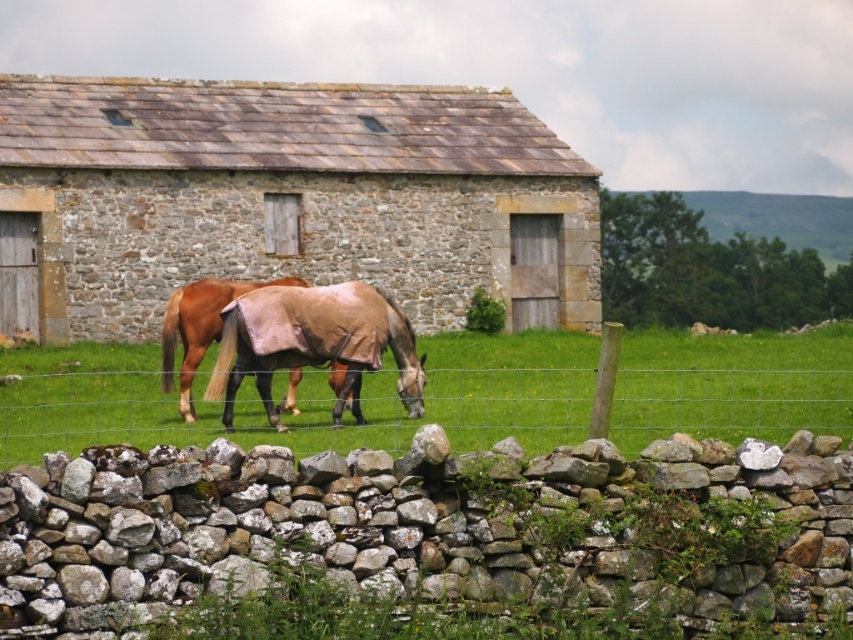
You are a farmer checking the weather conditions. You see the stone textured barn at center and the green grass at center. Which object would cast a longer shadow during midday?

The stone textured barn at center is bigger than green grass at center, so it would cast a longer shadow during midday.

You are standing in a field and see the stone textured barn at center and the green grass at center. Which object is closer to you?

The stone textured barn at center is closer to you because the green grass at center is behind it.

You are standing in the field and want to get a closer look at the brown leather horse at center without stepping on the green grass at center. Is there enough space around the horse to move around it?

The green grass at center is located below brown leather horse at center, so you can move around the horse without stepping on the grass by staying on the surrounding areas not covered by the grass.